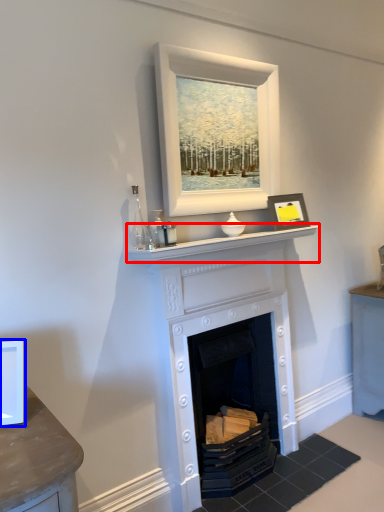
Question: Which object is closer to the camera taking this photo, mantle (highlighted by a red box) or picture frame (highlighted by a blue box)?

Choices:
 (A) mantle
 (B) picture frame

Answer: (B)